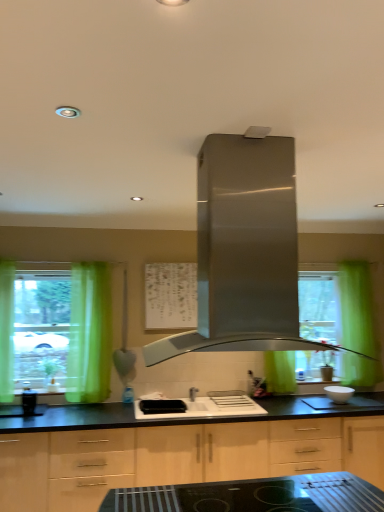
Find the location of `vacant space underneath green fabric curtain at left (from a real-world perspective)`. vacant space underneath green fabric curtain at left (from a real-world perspective) is located at coordinates (93, 401).